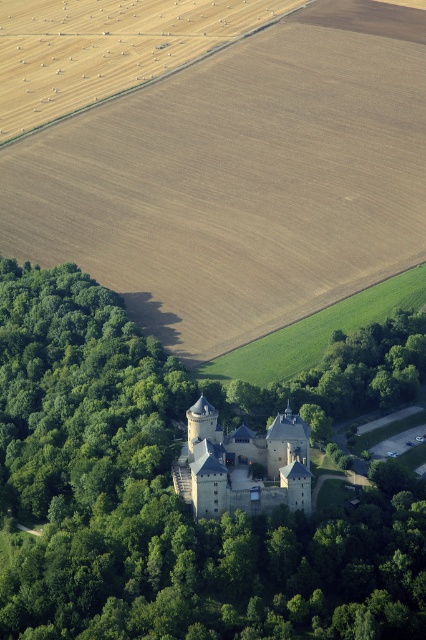
You are a drone pilot flying over the castle. You need to navigate between two points marked on your map. The first point is at coordinate point (20,467) and the second point is at coordinate point (273,435). Which point is closer to the castle?

Point (273,435) is closer to the castle because point (20,467) is behind it.